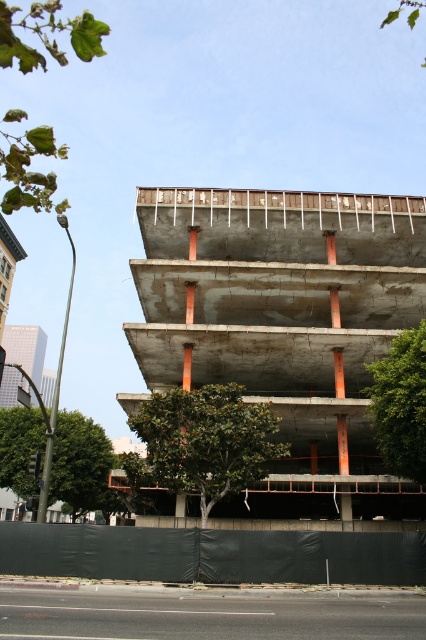
You are a construction worker standing at the base of the building and need to access the upper floors. Which tree, the green leafy tree at center or the green leafy tree at lower left, would block your view of the upper floors more?

The green leafy tree at center is closer to the viewer than the green leafy tree at lower left, so it would block your view of the upper floors more.

A construction worker is standing at point (40, 420) and needs to reach the incomplete railing on the uppermost level of the building. What is the straight line distance they need to cover?

The straight line distance between point (40, 420) and the incomplete railing on the uppermost level is 53.85 meters.